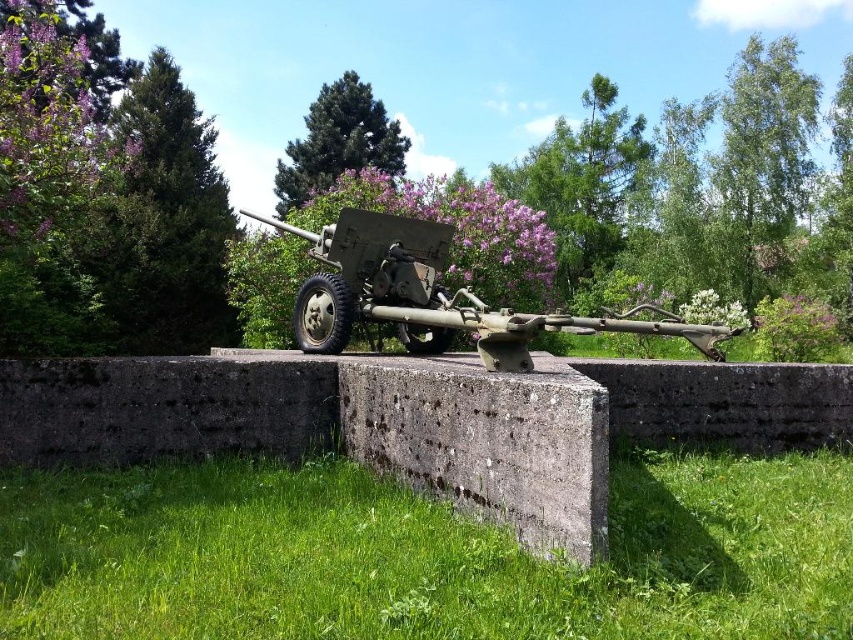
Question: Which object is the farthest from the green leafy tree at upper right?

Choices:
 (A) green grass at lower center
 (B) green textured pine tree at upper left

Answer: (A)

Question: Is gray concrete at center positioned before matte green cannon at center?

Choices:
 (A) no
 (B) yes

Answer: (B)

Question: Considering the real-world distances, which object is farthest from the green leafy tree at upper center?

Choices:
 (A) green textured pine tree at upper left
 (B) green leafy tree at upper right

Answer: (B)

Question: Which object is the farthest from the green grass at lower center?

Choices:
 (A) gray concrete at center
 (B) green leafy tree at upper center
 (C) green textured pine tree at upper left
 (D) matte green cannon at center

Answer: (B)

Question: Is green grass at lower center thinner than gray concrete at center?

Choices:
 (A) yes
 (B) no

Answer: (B)

Question: Observing the image, what is the correct spatial positioning of green grass at lower center in reference to green textured pine tree at upper left?

Choices:
 (A) left
 (B) right

Answer: (B)